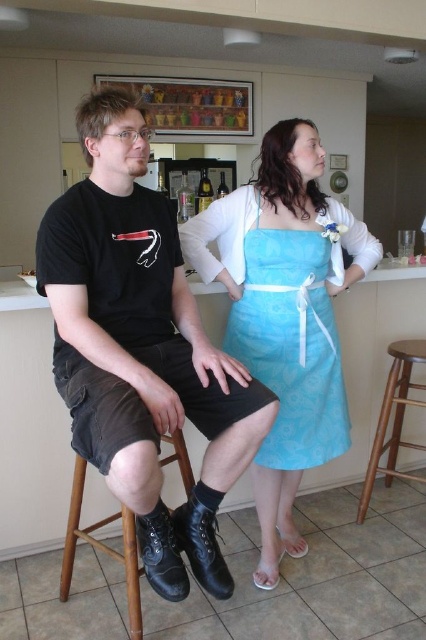
Which is behind, point (131, 211) or point (363, 497)?

The point (363, 497) is behind.

Does black leather boots at center appear on the left side of brown wooden bar stool at lower right?

Indeed, black leather boots at center is positioned on the left side of brown wooden bar stool at lower right.

Identify the location of black leather boots at center. (141, 348).

Where is `black leather boots at center`? black leather boots at center is located at coordinates (141, 348).

Does matte blue fabric dress at center appear under brown wooden bar stool at lower right?

No, matte blue fabric dress at center is not below brown wooden bar stool at lower right.

Can you confirm if matte blue fabric dress at center is positioned to the left of brown wooden bar stool at lower right?

Indeed, matte blue fabric dress at center is positioned on the left side of brown wooden bar stool at lower right.

Locate an element on the screen. matte blue fabric dress at center is located at coordinates (291, 340).

Which is more to the right, black leather stool at lower left or brown wooden bar stool at lower right?

From the viewer's perspective, brown wooden bar stool at lower right appears more on the right side.

Does point (178, 448) come farther from viewer compared to point (371, 472)?

No.

The height and width of the screenshot is (640, 426). I want to click on black leather stool at lower left, so click(103, 548).